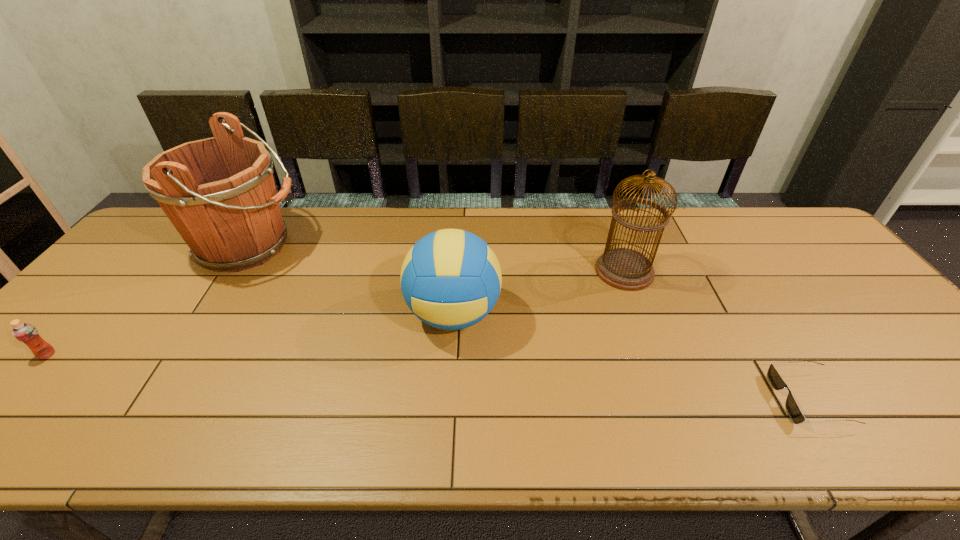
Identify the location of bucket. (219, 193).

Identify the location of the second object from right to left. The width and height of the screenshot is (960, 540). (622, 268).

Locate an element on the screen. the third tallest object is located at coordinates (451, 279).

At what (x,y) coordinates should I click in order to perform the action: click on volleyball. Please return your answer as a coordinate pair (x, y). The image size is (960, 540). Looking at the image, I should click on (451, 279).

You are a GUI agent. You are given a task and a screenshot of the screen. Output one action in this format:
    pyautogui.click(x=<x>, y=<y>)
    Task: Click on the fourth tallest object
    This screenshot has height=540, width=960.
    Given the screenshot: What is the action you would take?
    pyautogui.click(x=28, y=334)

Identify the location of orange juice. This screenshot has height=540, width=960. (28, 334).

Locate an element on the screen. The height and width of the screenshot is (540, 960). sunglasses is located at coordinates (792, 408).

Locate an element on the screen. The height and width of the screenshot is (540, 960). the rightmost object is located at coordinates (792, 408).

Identify the location of vacant space located 0.090m with the handle on the side of the bucket. (333, 246).

Where is `vacant space located 0.160m on the front-facing side of the birdcage`? This screenshot has width=960, height=540. vacant space located 0.160m on the front-facing side of the birdcage is located at coordinates (540, 271).